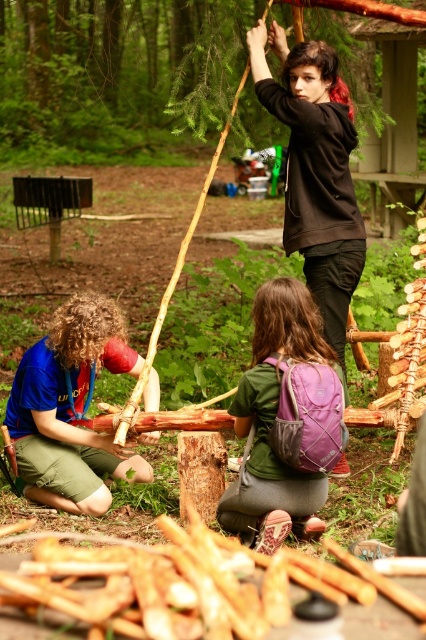
Question: Can you confirm if black matte hoodie at upper center is positioned above blue fabric shirt at lower left?

Choices:
 (A) no
 (B) yes

Answer: (B)

Question: Which point is farther from the camera taking this photo?

Choices:
 (A) (299, 134)
 (B) (17, 369)

Answer: (A)

Question: Which point appears farthest from the camera in this image?

Choices:
 (A) (22, 429)
 (B) (313, 396)
 (C) (336, 150)

Answer: (C)

Question: Which object is the closest to the green fabric backpack at center?

Choices:
 (A) black matte hoodie at upper center
 (B) blue fabric shirt at lower left

Answer: (B)

Question: In this image, where is green fabric backpack at center located relative to blue fabric shirt at lower left?

Choices:
 (A) right
 (B) left

Answer: (A)

Question: Is green fabric backpack at center wider than blue fabric shirt at lower left?

Choices:
 (A) yes
 (B) no

Answer: (B)